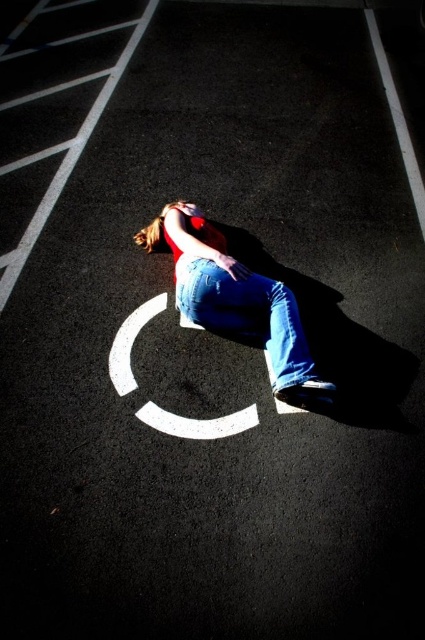
Between denim jeans at center and jeans at center, which one is positioned lower?

jeans at center is below.

Does denim jeans at center have a greater width compared to jeans at center?

Yes.

Identify the location of denim jeans at center. (237, 300).

Which is in front, point (244, 320) or point (231, 413)?

Positioned in front is point (231, 413).

Can you confirm if jeans at center is bigger than white painted circle at center?

No.

Identify the location of jeans at center. (246, 314).

Measure the distance between point (178, 260) and camera.

Point (178, 260) is 3.29 meters away from camera.

Is denim jeans at center positioned in front of white painted circle at center?

Yes, denim jeans at center is in front of white painted circle at center.

This screenshot has width=425, height=640. What do you see at coordinates (237, 300) in the screenshot?
I see `denim jeans at center` at bounding box center [237, 300].

Where is `denim jeans at center`? The height and width of the screenshot is (640, 425). denim jeans at center is located at coordinates (237, 300).